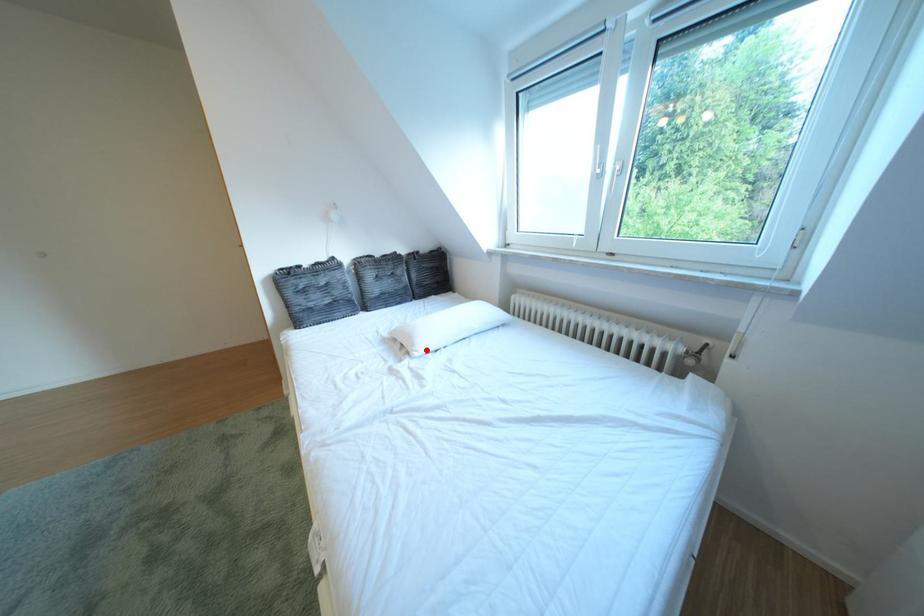
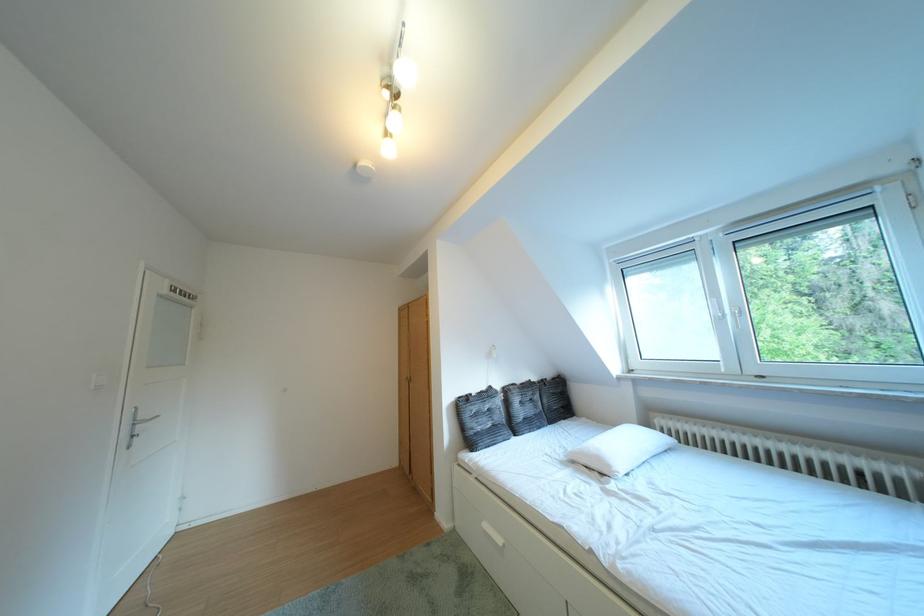
In the second image, find the point that corresponds to the highlighted location in the first image.

(623, 471)